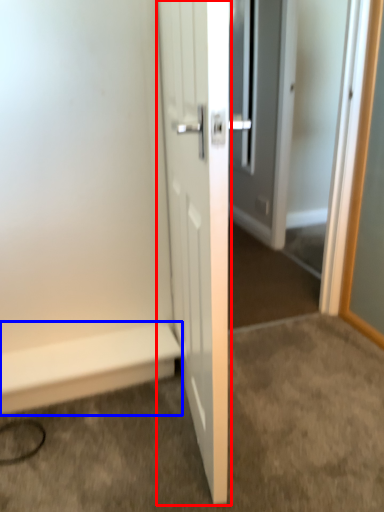
Question: Which object appears farthest to the camera in this image, door (highlighted by a red box) or stairwell (highlighted by a blue box)?

Choices:
 (A) door
 (B) stairwell

Answer: (B)